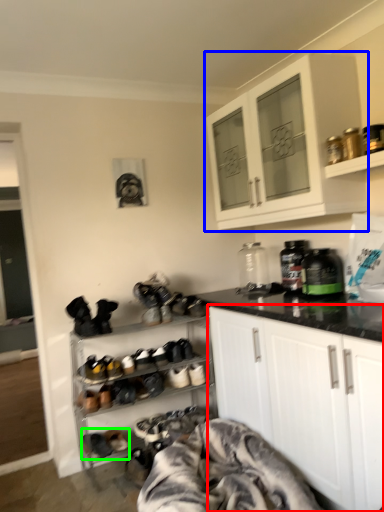
Question: Which is farther away from cabinetry (highlighted by a red box)? cabinetry (highlighted by a blue box) or footwear (highlighted by a green box)?

Choices:
 (A) cabinetry
 (B) footwear

Answer: (B)